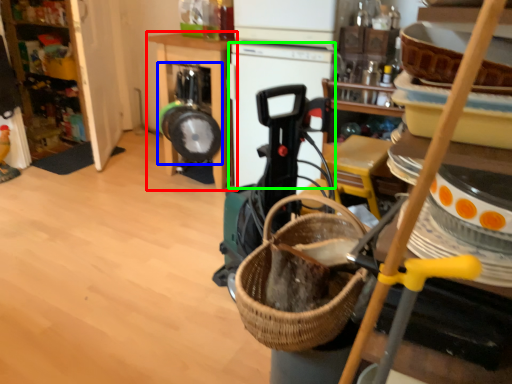
Question: Considering the real-world distances, which object is farthest from furniture (highlighted by a red box)? appliance (highlighted by a blue box) or appliance (highlighted by a green box)?

Choices:
 (A) appliance
 (B) appliance

Answer: (B)